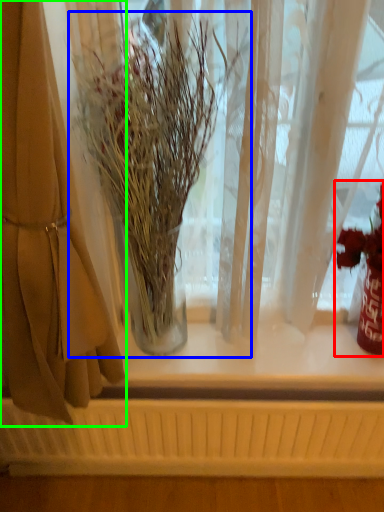
Question: Based on their relative distances, which object is nearer to floral arrangement (highlighted by a red box)? Choose from houseplant (highlighted by a blue box) and curtain (highlighted by a green box).

Choices:
 (A) houseplant
 (B) curtain

Answer: (A)